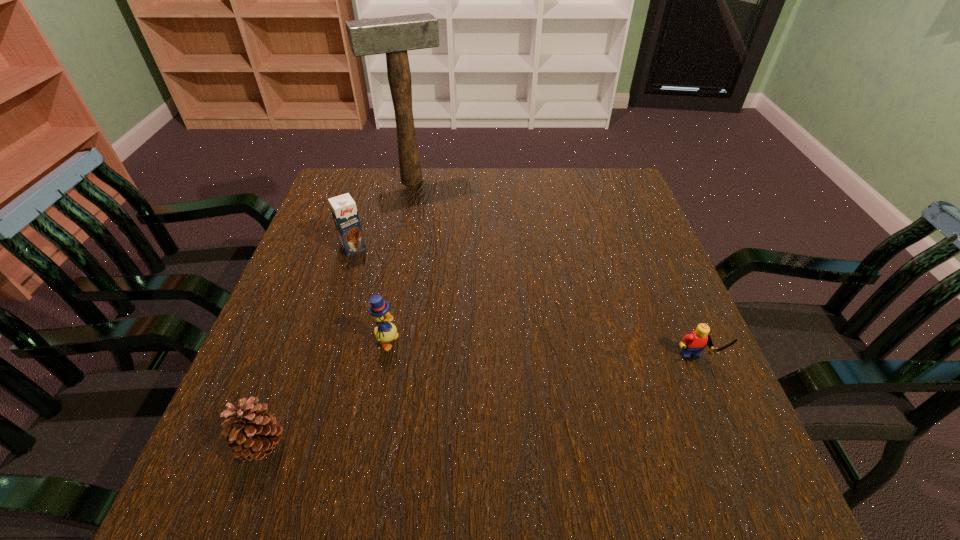
In order to click on pinecone in this screenshot , I will do `click(252, 434)`.

You are a GUI agent. You are given a task and a screenshot of the screen. Output one action in this format:
    pyautogui.click(x=<x>, y=<y>)
    Task: Click on the rightmost object
    The width and height of the screenshot is (960, 540).
    Given the screenshot: What is the action you would take?
    point(693,343)

The width and height of the screenshot is (960, 540). In order to click on the fourth nearest object in this screenshot , I will do `click(344, 211)`.

Locate an element on the screen. This screenshot has height=540, width=960. chocolate milk is located at coordinates (344, 211).

The width and height of the screenshot is (960, 540). Find the location of `duckling`. duckling is located at coordinates (385, 332).

Locate an element on the screen. the farthest object is located at coordinates (396, 35).

Where is `the tallest object`? The width and height of the screenshot is (960, 540). the tallest object is located at coordinates (396, 35).

Locate an element on the screen. vacant region located 0.050m on the right of the pinecone is located at coordinates (317, 446).

Where is `free spot located on the front label of the fourth shortest object`? free spot located on the front label of the fourth shortest object is located at coordinates (410, 340).

Locate an element on the screen. free space located on the front label of the fourth shortest object is located at coordinates (382, 295).